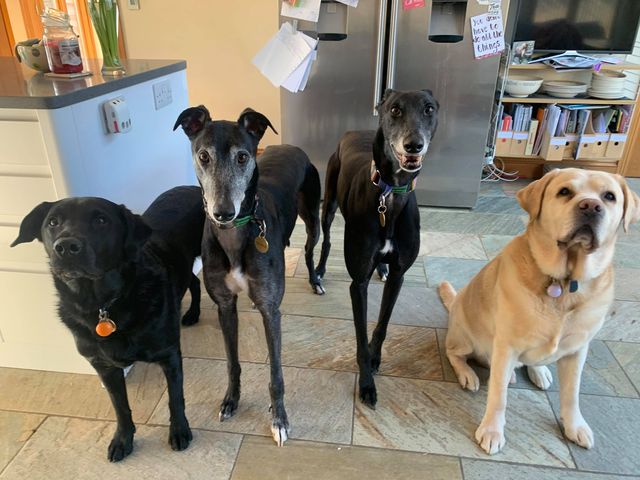
Image resolution: width=640 pixels, height=480 pixels. I want to click on drawers, so click(x=29, y=134), click(x=17, y=194), click(x=6, y=253), click(x=17, y=297).